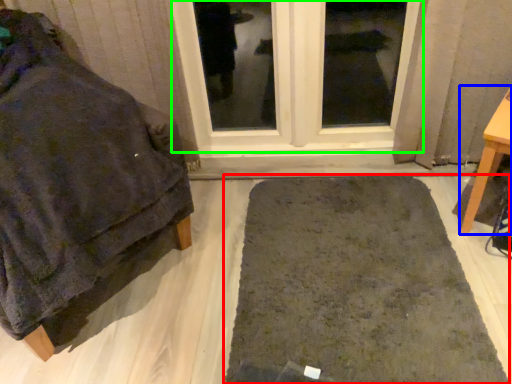
Question: Which is farther away from bath mat (highlighted by a red box)? furniture (highlighted by a blue box) or window (highlighted by a green box)?

Choices:
 (A) furniture
 (B) window

Answer: (B)